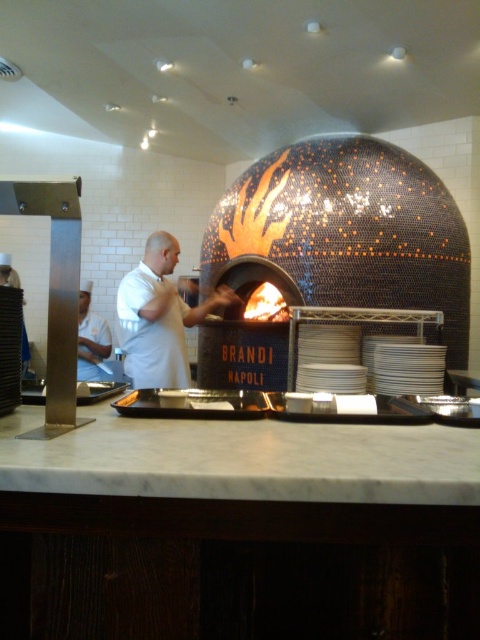
You are a customer standing in the pizzeria and want to know if the white matte uniform at center worn by the chef is taller than the brushed metal exhaust hood at left. Can you confirm this?

The white matte uniform at center is taller than the brushed metal exhaust hood at left according to the description provided.